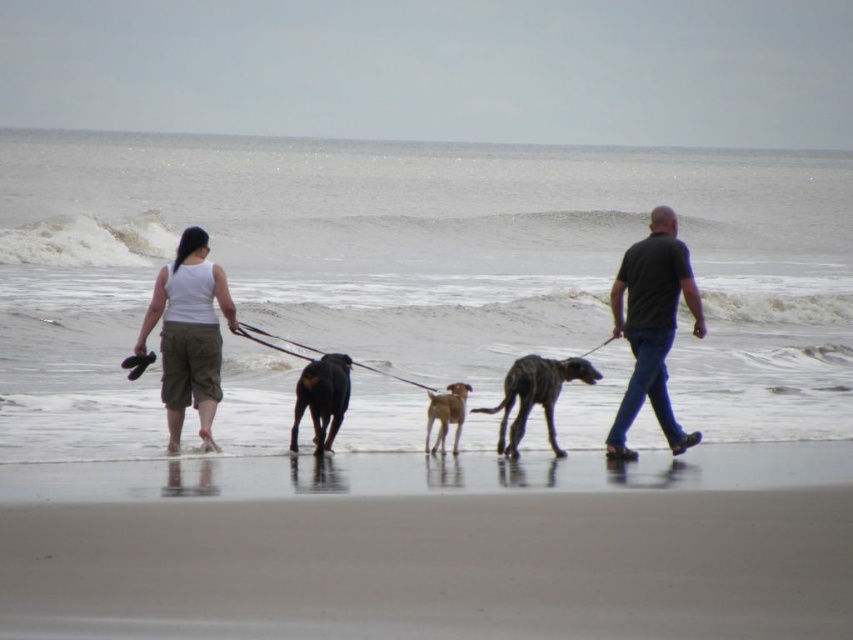
Question: Is black matte shirt at right above light brown fur at center?

Choices:
 (A) no
 (B) yes

Answer: (B)

Question: In this image, where is white cotton tank top at left located relative to shiny black dog at center?

Choices:
 (A) right
 (B) left

Answer: (B)

Question: Among these points, which one is nearest to the camera?

Choices:
 (A) (520, 369)
 (B) (347, 374)
 (C) (442, 436)
 (D) (173, 273)

Answer: (D)

Question: Which point is farther to the camera?

Choices:
 (A) (535, 376)
 (B) (181, 342)
 (C) (634, 531)

Answer: (A)

Question: Which object is farther from the camera taking this photo?

Choices:
 (A) light brown fur at center
 (B) smooth sand at lower center
 (C) shiny black dog at center

Answer: (A)

Question: In this image, where is white cotton tank top at left located relative to spotted fur dog at center?

Choices:
 (A) left
 (B) right

Answer: (A)